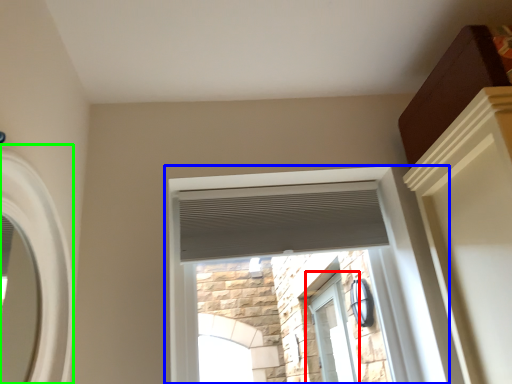
Question: Estimate the real-world distances between objects in this image. Which object is farther from window (highlighted by a red box), window (highlighted by a blue box) or window (highlighted by a green box)?

Choices:
 (A) window
 (B) window

Answer: (B)